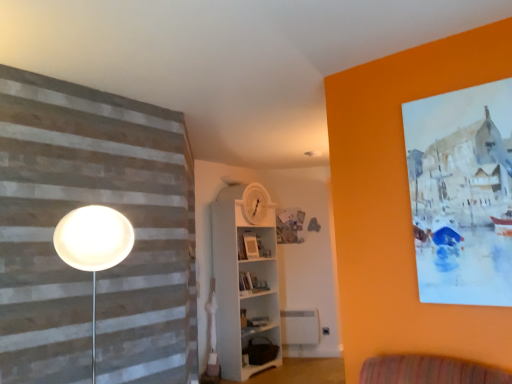
Question: From a real-world perspective, is matte white picture frame at center located beneath white wooden shelf at center, the second shelf ordered from the bottom?

Choices:
 (A) no
 (B) yes

Answer: (A)

Question: Can you confirm if matte white picture frame at center is positioned to the left of white wooden shelf at center, the second shelf ordered from the bottom?

Choices:
 (A) yes
 (B) no

Answer: (B)

Question: From a real-world perspective, is matte white picture frame at center physically above white wooden shelf at center, the second shelf ordered from the bottom?

Choices:
 (A) no
 (B) yes

Answer: (B)

Question: Considering the relative sizes of matte white picture frame at center and white wooden shelf at center, the second shelf ordered from the bottom, in the image provided, is matte white picture frame at center smaller than white wooden shelf at center, the second shelf ordered from the bottom,?

Choices:
 (A) yes
 (B) no

Answer: (A)

Question: Could you tell me if matte white picture frame at center is facing white wooden shelf at center, the second shelf ordered from the bottom?

Choices:
 (A) no
 (B) yes

Answer: (B)

Question: Looking at their shapes, would you say white wooden shelf at center, which is counted as the first shelf, starting from the top, is wider or thinner than matte white picture frame at center?

Choices:
 (A) wide
 (B) thin

Answer: (A)

Question: In the image, is white wooden shelf at center, the second shelf ordered from the bottom, on the left side or the right side of matte white picture frame at center?

Choices:
 (A) left
 (B) right

Answer: (A)

Question: Is white wooden shelf at center, which is counted as the first shelf, starting from the top, spatially inside matte white picture frame at center, or outside of it?

Choices:
 (A) inside
 (B) outside

Answer: (B)

Question: From a real-world perspective, is white wooden shelf at center, the second shelf ordered from the bottom, above or below matte white picture frame at center?

Choices:
 (A) above
 (B) below

Answer: (B)

Question: In terms of size, does matte white picture frame at center appear bigger or smaller than white wooden shelf at center, which is counted as the first shelf, starting from the top?

Choices:
 (A) small
 (B) big

Answer: (A)

Question: In the image, is matte white picture frame at center positioned in front of or behind white wooden shelf at center, the second shelf ordered from the bottom?

Choices:
 (A) behind
 (B) front

Answer: (A)

Question: Considering the positions of matte white picture frame at center and white wooden shelf at center, the second shelf ordered from the bottom, in the image, is matte white picture frame at center wider or thinner than white wooden shelf at center, the second shelf ordered from the bottom,?

Choices:
 (A) wide
 (B) thin

Answer: (B)

Question: From the image's perspective, is matte white picture frame at center above or below white wooden shelf at center, the second shelf ordered from the bottom?

Choices:
 (A) above
 (B) below

Answer: (A)

Question: From the image's perspective, is brown fabric bag at lower center, which appears as the 2th shelf when viewed from the top, positioned above or below white wooden shelf at center, which is counted as the first shelf, starting from the top?

Choices:
 (A) below
 (B) above

Answer: (A)

Question: Is point (261, 354) positioned closer to the camera than point (244, 337)?

Choices:
 (A) farther
 (B) closer

Answer: (A)